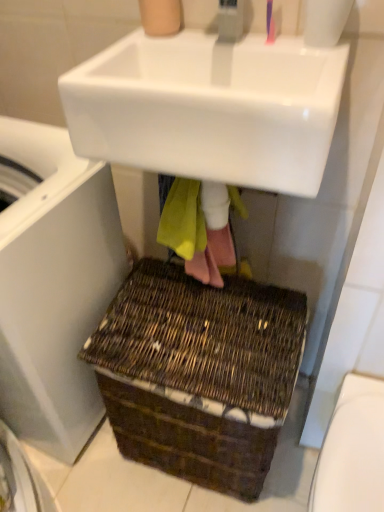
Question: Based on their positions, is pink plastic toothbrush at upper center located to the left or right of white plastic washing machine at lower left?

Choices:
 (A) left
 (B) right

Answer: (B)

Question: Is pink plastic toothbrush at upper center inside the boundaries of white plastic washing machine at lower left, or outside?

Choices:
 (A) inside
 (B) outside

Answer: (B)

Question: Which object is positioned closest to the brown woven basket at lower center?

Choices:
 (A) white plastic washing machine at lower left
 (B) white glossy sink at upper center
 (C) white glossy toilet bowl at lower right
 (D) pink plastic toothbrush at upper center

Answer: (A)

Question: Based on their relative distances, which object is nearer to the white plastic washing machine at lower left?

Choices:
 (A) pink plastic toothbrush at upper center
 (B) white glossy sink at upper center
 (C) brown woven basket at lower center
 (D) white glossy toilet bowl at lower right

Answer: (C)